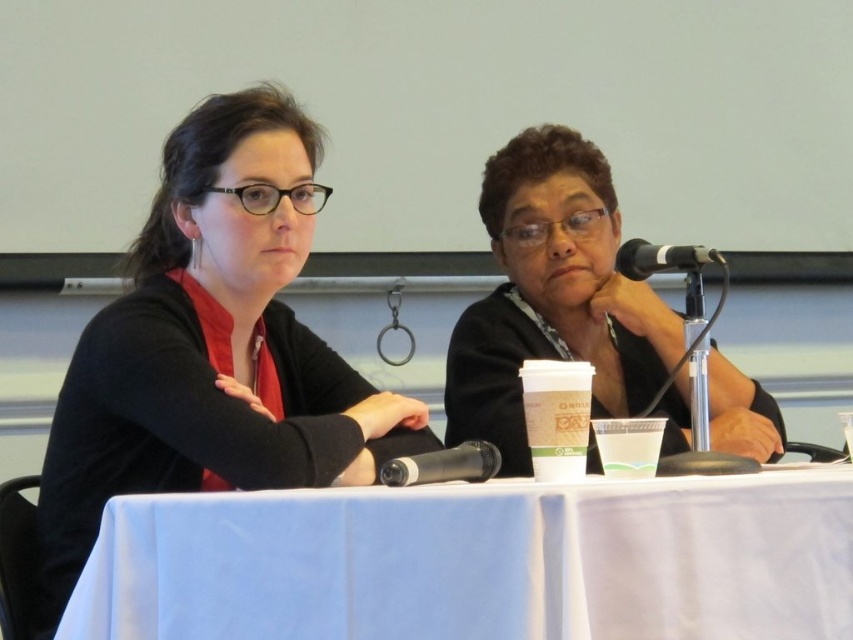
Question: Can you confirm if blue fabric table at center is wider than black matte microphone at center?

Choices:
 (A) no
 (B) yes

Answer: (B)

Question: Which point appears farthest from the camera in this image?

Choices:
 (A) (369, 392)
 (B) (720, 257)
 (C) (223, 577)

Answer: (A)

Question: Observing the image, what is the correct spatial positioning of matte black shirt at left in reference to black matte microphone at center?

Choices:
 (A) below
 (B) above

Answer: (B)

Question: Among these points, which one is farthest from the camera?

Choices:
 (A) (479, 449)
 (B) (280, 509)
 (C) (254, 442)
 (D) (561, 282)

Answer: (D)

Question: Where is matte black shirt at center located in relation to black plastic microphone at upper right in the image?

Choices:
 (A) left
 (B) right

Answer: (A)

Question: Which of the following is the farthest from the observer?

Choices:
 (A) (543, 163)
 (B) (299, 209)
 (C) (659, 259)
 (D) (454, 464)

Answer: (A)